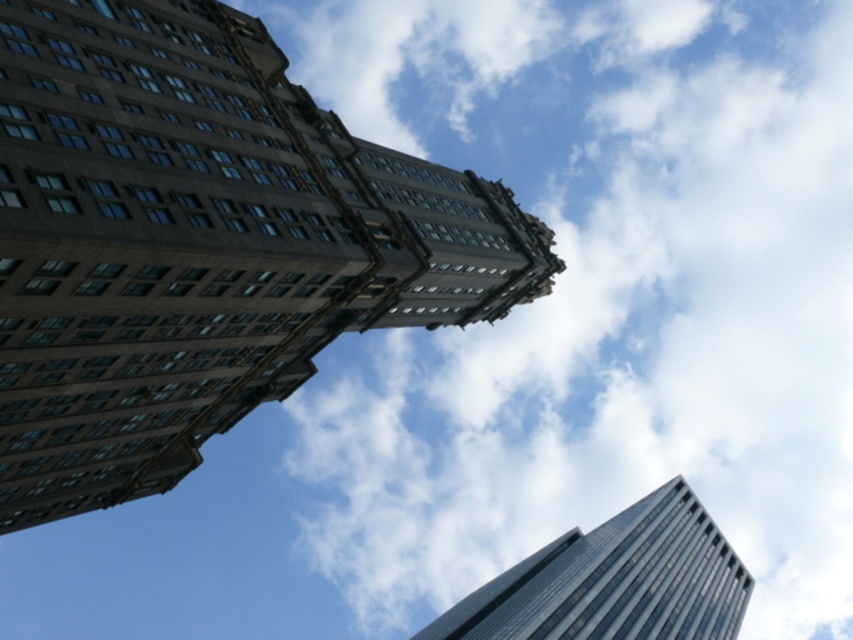
Does white fluffy cloud at upper center have a smaller size compared to glassy reflective skyscraper at lower right?

No, white fluffy cloud at upper center is not smaller than glassy reflective skyscraper at lower right.

Who is lower down, white fluffy cloud at upper center or glassy reflective skyscraper at lower right?

Positioned lower is glassy reflective skyscraper at lower right.

Identify the location of white fluffy cloud at upper center. (596, 296).

The width and height of the screenshot is (853, 640). What are the coordinates of `white fluffy cloud at upper center` in the screenshot? It's located at (596, 296).

Which is more to the left, brown stone tower at upper left or glassy reflective skyscraper at lower right?

From the viewer's perspective, brown stone tower at upper left appears more on the left side.

Locate an element on the screen. brown stone tower at upper left is located at coordinates (199, 243).

Does white fluffy cloud at upper center have a smaller size compared to brown stone tower at upper left?

Incorrect, white fluffy cloud at upper center is not smaller in size than brown stone tower at upper left.

Is white fluffy cloud at upper center further to the viewer compared to brown stone tower at upper left?

Yes, it is behind brown stone tower at upper left.

This screenshot has width=853, height=640. Describe the element at coordinates (596, 296) in the screenshot. I see `white fluffy cloud at upper center` at that location.

Locate an element on the screen. white fluffy cloud at upper center is located at coordinates (596, 296).